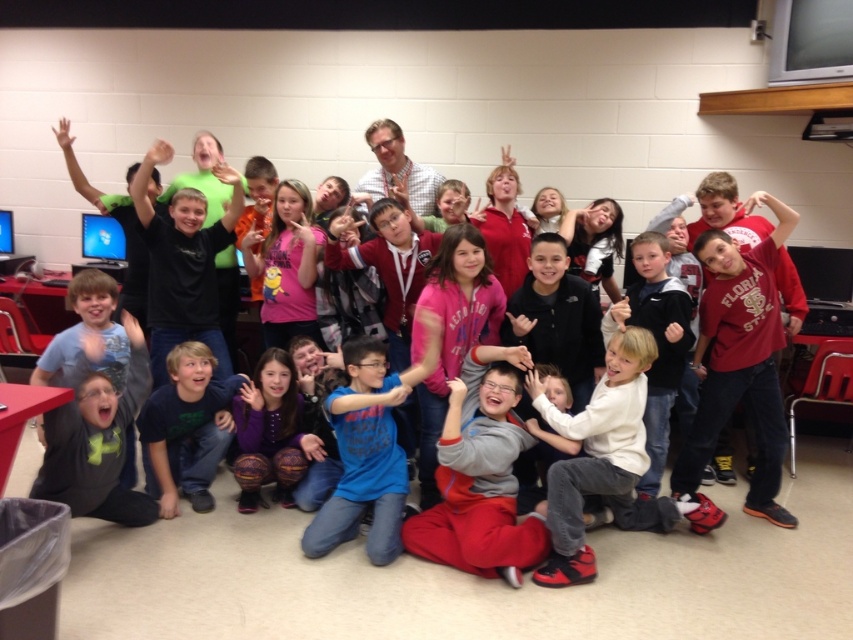
Question: Where is matte gray hoodie at center located in relation to dark blue cotton shirt at lower left in the image?

Choices:
 (A) left
 (B) right

Answer: (B)

Question: Which is nearer to the purple fuzzy socks at lower center?

Choices:
 (A) white cotton shirt at center
 (B) dark blue cotton shirt at lower left

Answer: (B)

Question: Is matte gray hoodie at center to the right of purple fuzzy socks at lower center from the viewer's perspective?

Choices:
 (A) no
 (B) yes

Answer: (B)

Question: Is white cotton shirt at center smaller than dark blue cotton shirt at lower left?

Choices:
 (A) yes
 (B) no

Answer: (B)

Question: Which point appears farthest from the camera in this image?

Choices:
 (A) (254, 458)
 (B) (196, 342)

Answer: (A)

Question: Which point is closer to the camera taking this photo?

Choices:
 (A) (245, 481)
 (B) (178, 461)
 (C) (585, 550)

Answer: (C)